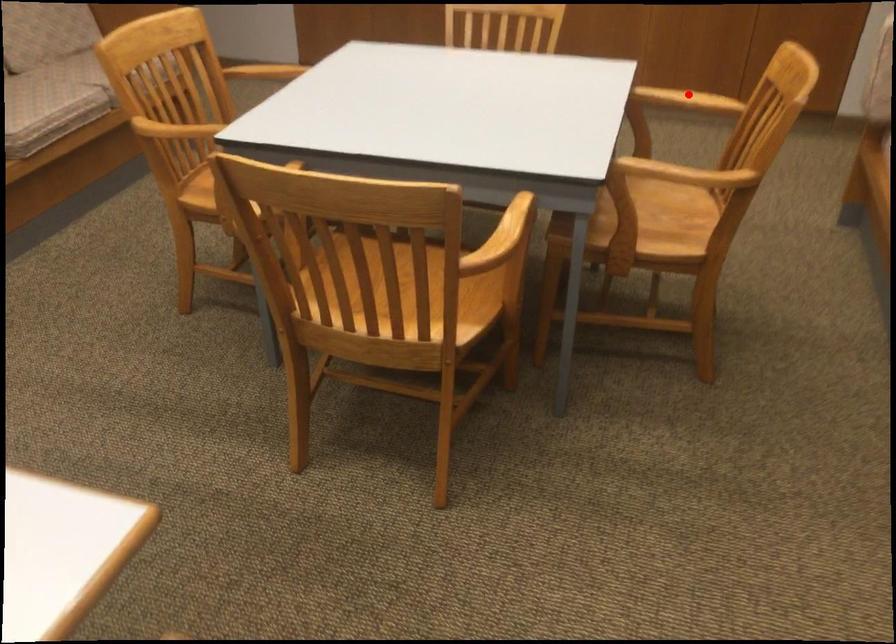
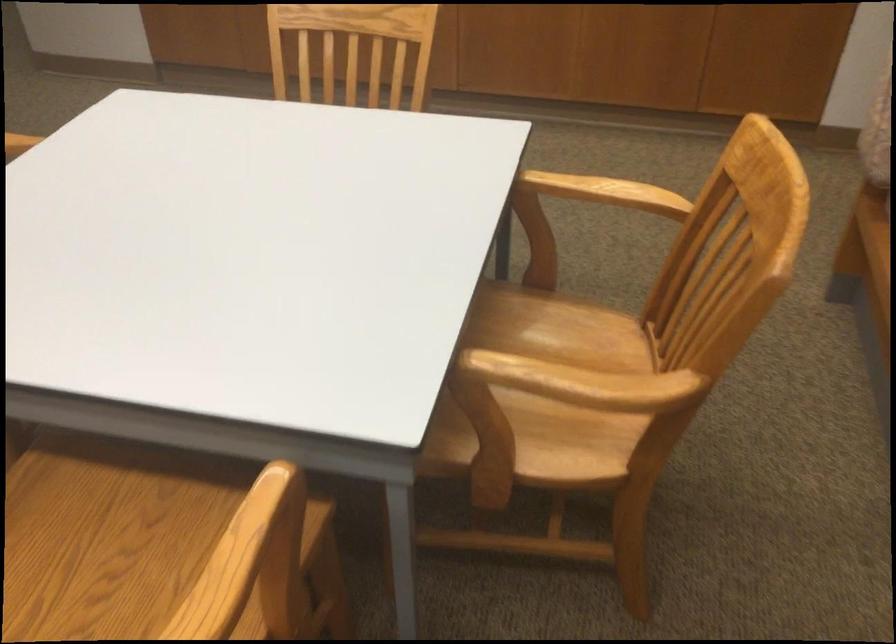
Question: A red point is marked in image1. In image2, is the corresponding 3D point closer to the camera or farther? Reply with the corresponding letter.

Choices:
 (A) The corresponding 3D point is closer.
 (B) The corresponding 3D point is farther.

Answer: (A)